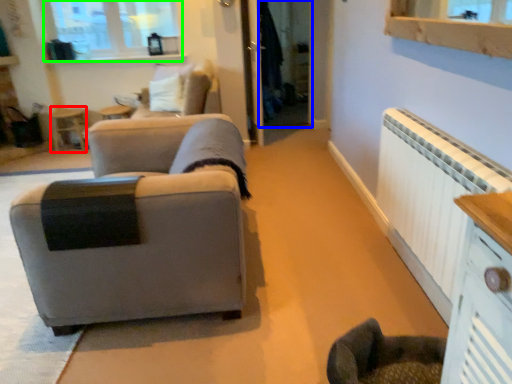
Question: Which object is the farthest from side table (highlighted by a red box)? Choose among these: glass door (highlighted by a blue box) or window (highlighted by a green box).

Choices:
 (A) glass door
 (B) window

Answer: (A)